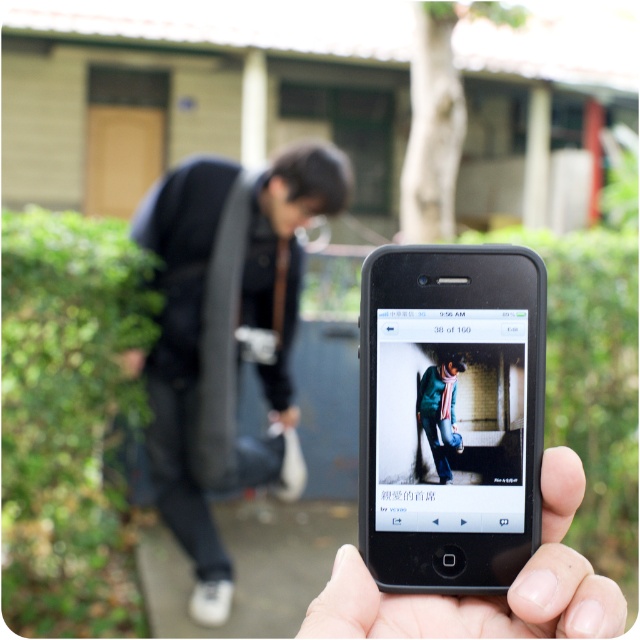
Can you confirm if black fabric bag at left is thinner than green woolen sweater at center?

In fact, black fabric bag at left might be wider than green woolen sweater at center.

Which of these two, black fabric bag at left or green woolen sweater at center, stands taller?

Standing taller between the two is black fabric bag at left.

What are the coordinates of `black fabric bag at left` in the screenshot? It's located at (224, 333).

Does black matte phone at lower center have a smaller size compared to green woolen sweater at center?

Incorrect, black matte phone at lower center is not smaller in size than green woolen sweater at center.

Can you confirm if black matte phone at lower center is positioned to the left of green woolen sweater at center?

Incorrect, black matte phone at lower center is not on the left side of green woolen sweater at center.

Find the location of a particular element. The width and height of the screenshot is (640, 640). black matte phone at lower center is located at coordinates (483, 595).

Locate an element on the screen. black matte phone at lower center is located at coordinates (483, 595).

How distant is black fabric bag at left from black matte phone at lower center?

black fabric bag at left and black matte phone at lower center are 3.39 meters apart from each other.

Consider the image. Is black fabric bag at left positioned in front of black matte phone at lower center?

That is False.

Identify the location of black fabric bag at left. (224, 333).